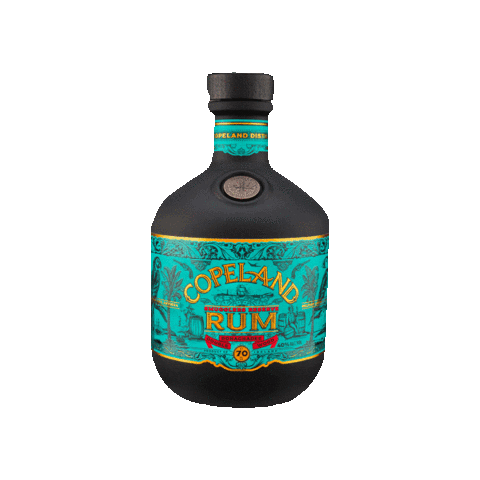
The image size is (480, 480). Identify the location of gold trim on bottle. click(279, 243), click(300, 361), click(215, 374).